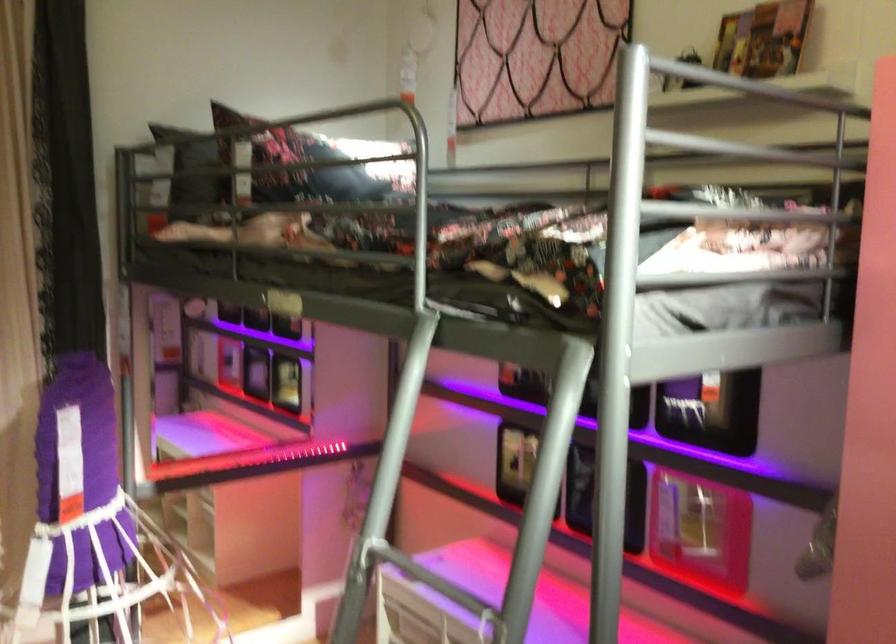
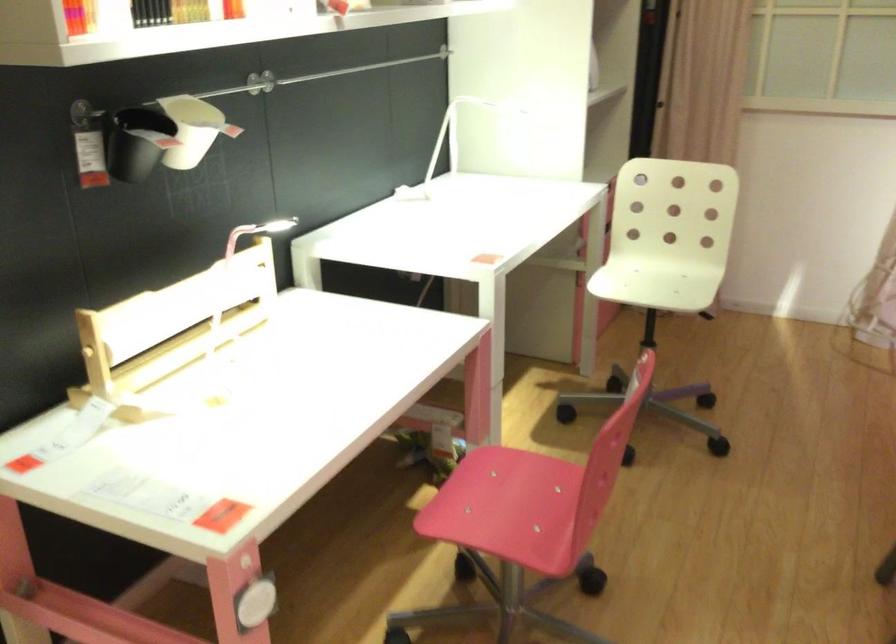
First-person continuous shooting, in which direction is the camera rotating?

The rotation direction of the camera is left-down.